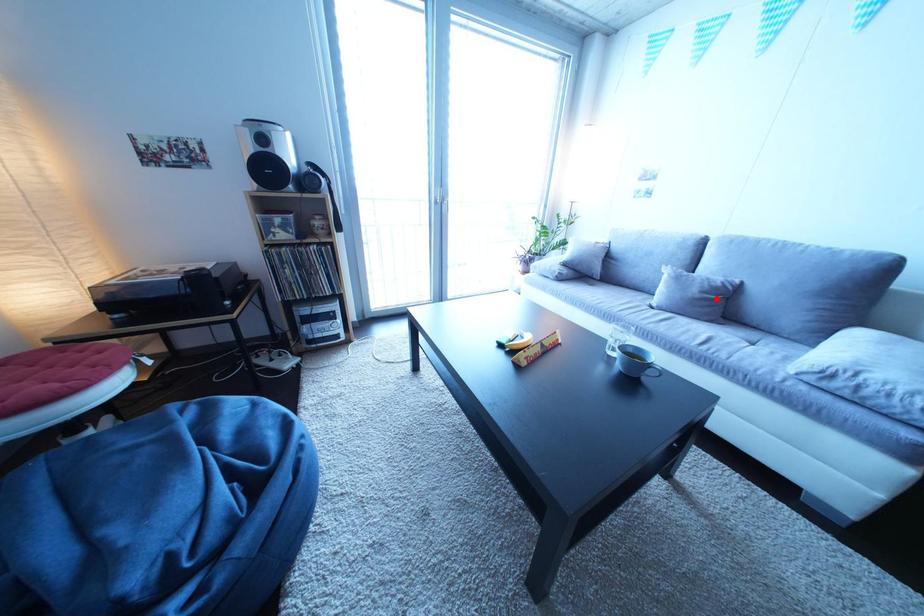
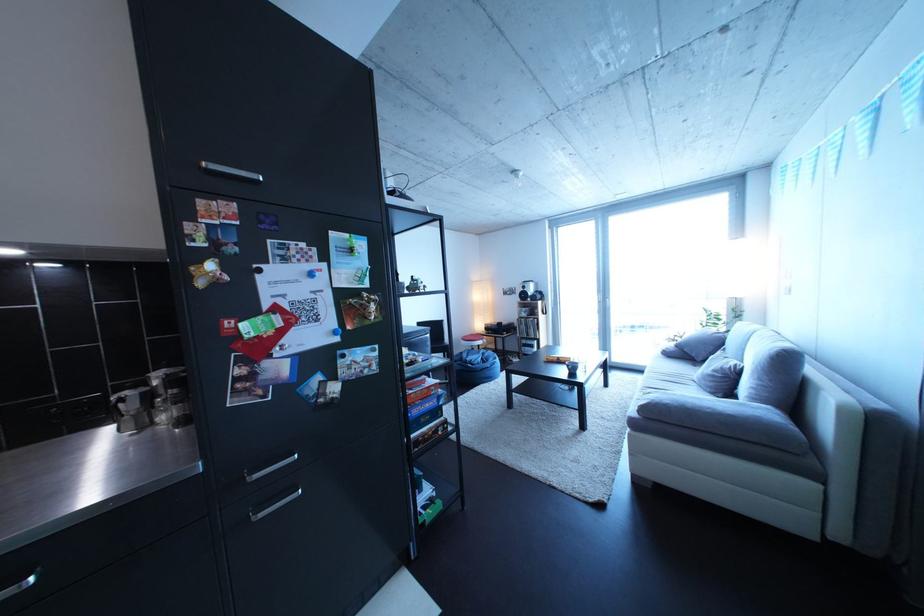
Where in the second image is the point corresponding to the highlighted location from the first image?

(727, 377)